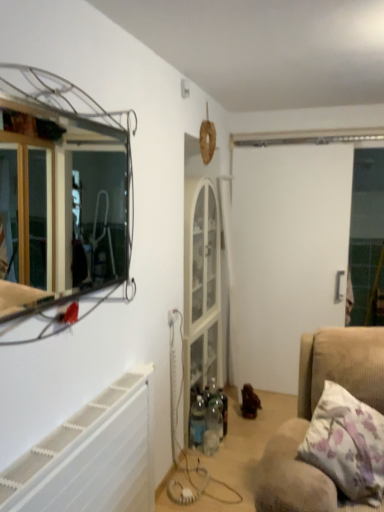
The image size is (384, 512). I want to click on blank area beneath metallic wire frame mirror at upper left (from a real-world perspective), so click(82, 415).